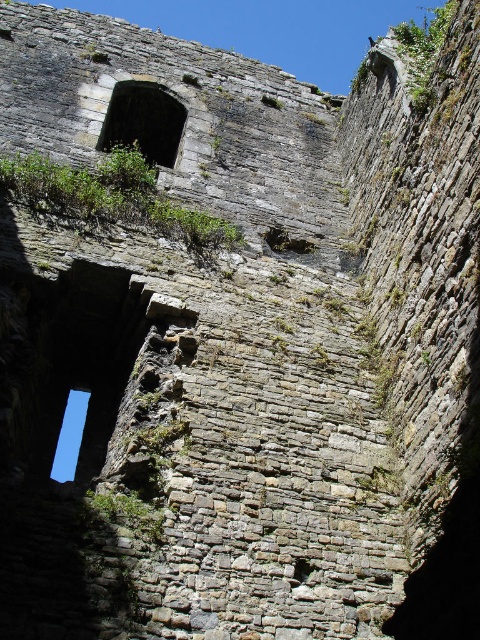
Question: Which point is closer to the camera taking this photo?

Choices:
 (A) (167, 141)
 (B) (170, 221)

Answer: (B)

Question: Can you confirm if stone textured window at upper center is smaller than transparent glass window at upper left?

Choices:
 (A) no
 (B) yes

Answer: (B)

Question: Which of the following is the farthest from the observer?

Choices:
 (A) stone textured window at upper center
 (B) transparent glass window at upper left

Answer: (A)

Question: Which object is positioned closest to the stone textured window at upper center?

Choices:
 (A) green mossy wall at upper center
 (B) transparent glass window at upper left

Answer: (A)

Question: From the image, what is the correct spatial relationship of green mossy wall at upper center in relation to transparent glass window at upper left?

Choices:
 (A) left
 (B) right

Answer: (B)

Question: Can you confirm if green mossy wall at upper center is thinner than transparent glass window at upper left?

Choices:
 (A) yes
 (B) no

Answer: (A)